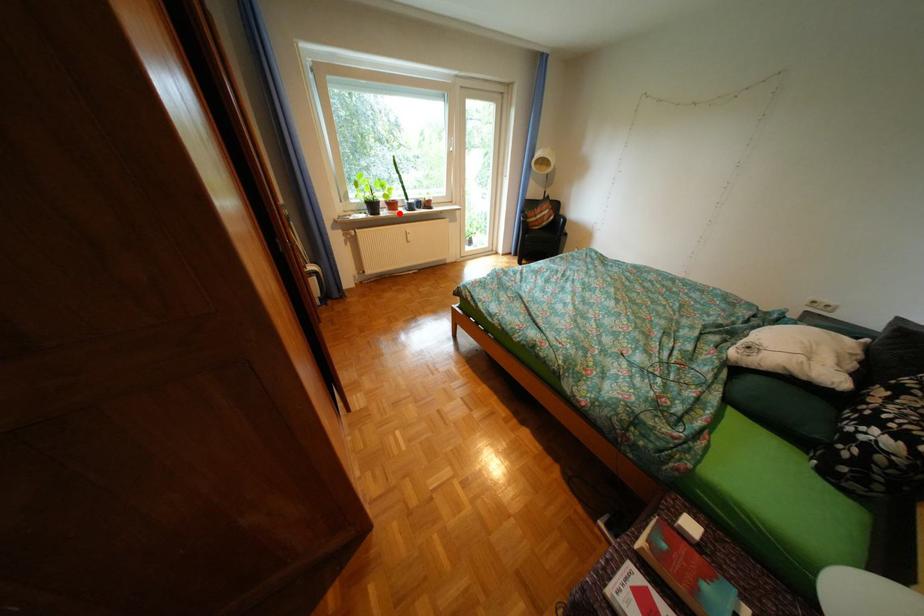
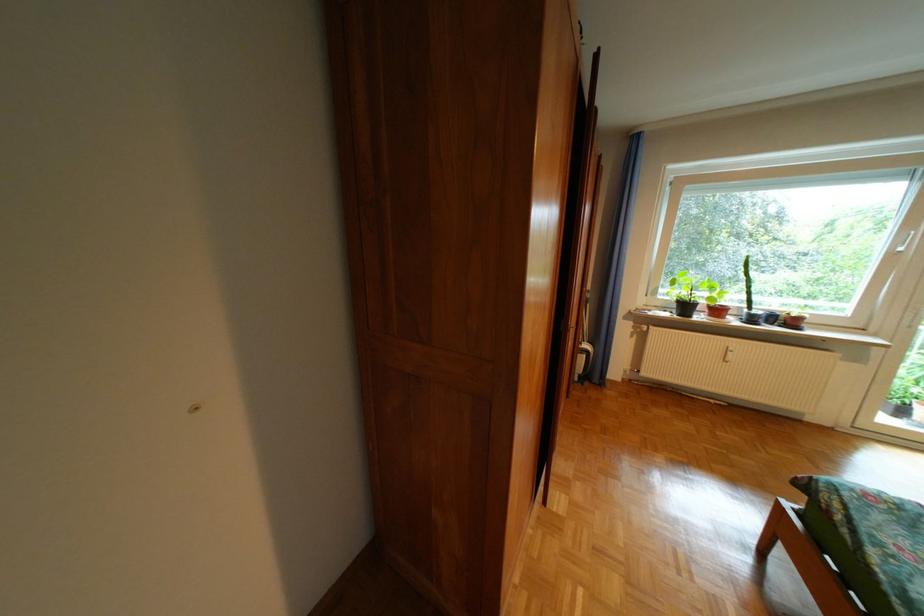
The point at the highlighted location is marked in the first image. Where is the corresponding point in the second image?

(714, 318)